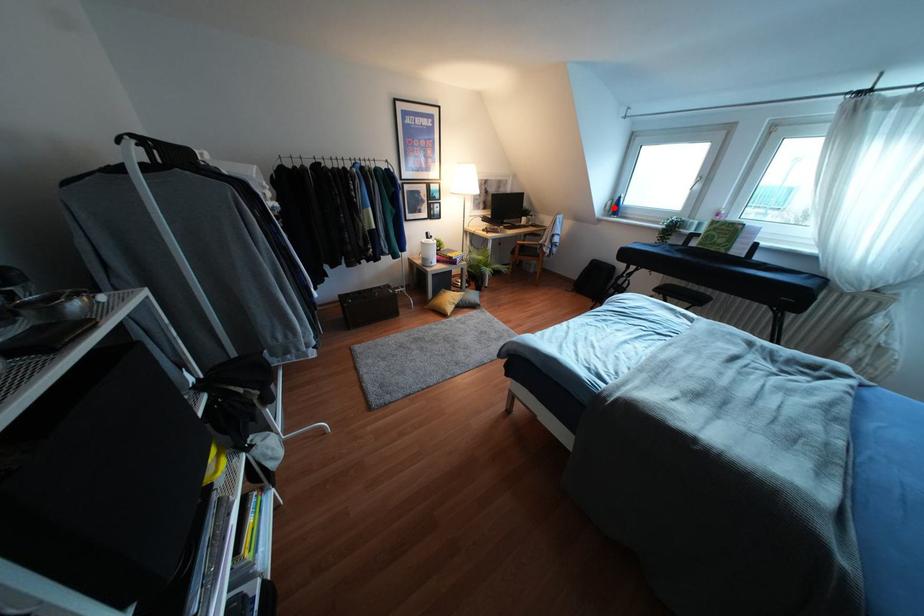
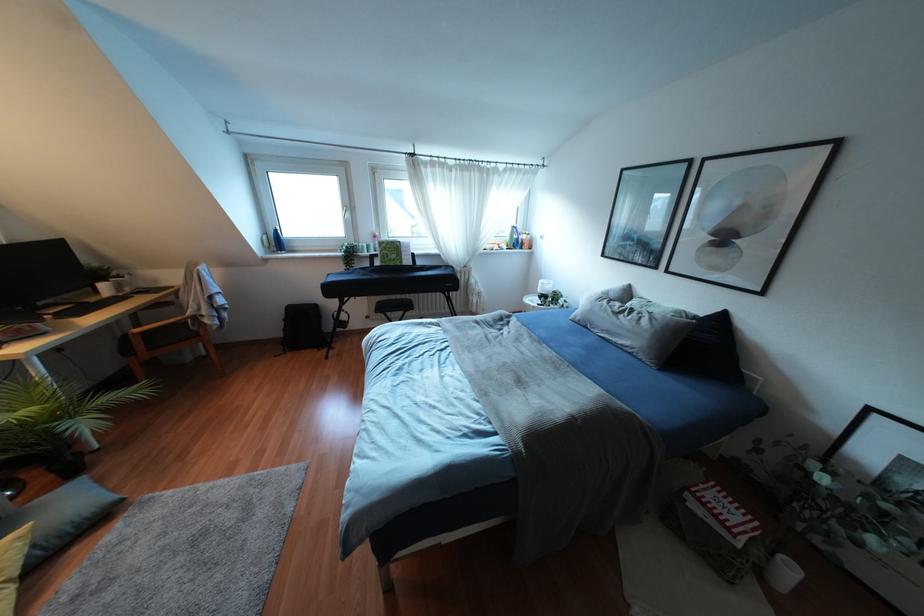
Question: I am providing you with two images of the same scene from different viewpoints. Image1 has a red point marked. In image2, the corresponding 3D location appears at what relative position? Reply with the corresponding letter.

Choices:
 (A) Closer
 (B) Farther

Answer: (B)